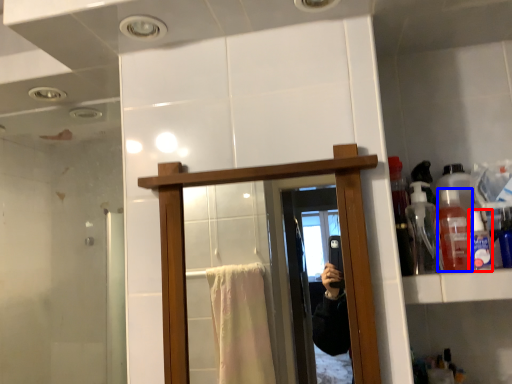
Question: Among these objects, which one is nearest to the camera, toiletry (highlighted by a red box) or bottle (highlighted by a blue box)?

Choices:
 (A) toiletry
 (B) bottle

Answer: (A)